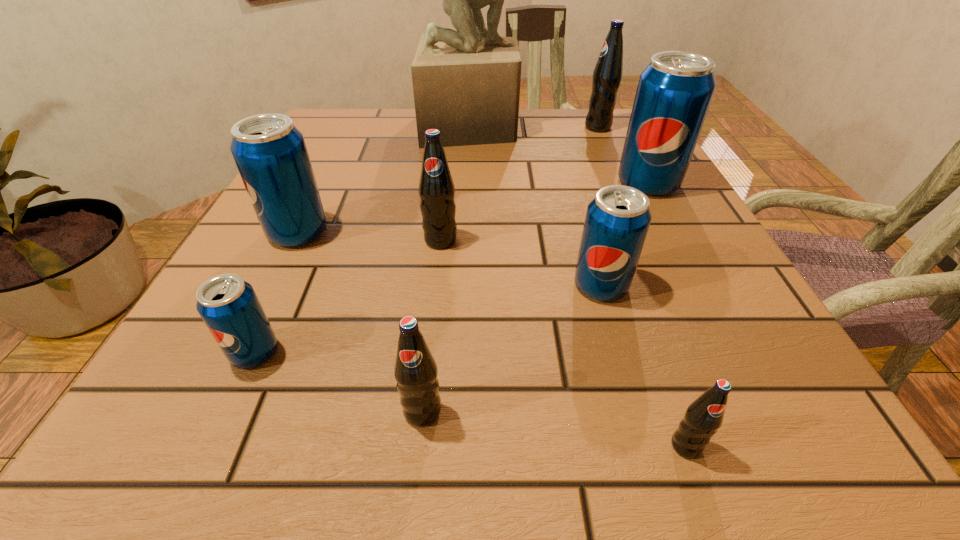
Locate an element on the screen. vacant space at the near edge of the desktop is located at coordinates (541, 396).

The width and height of the screenshot is (960, 540). In the image, there is a desktop. Identify the location of vacant space at the left edge. (344, 173).

The image size is (960, 540). Identify the location of blank space at the right edge. (658, 235).

Locate an element on the screen. The height and width of the screenshot is (540, 960). free space at the far right corner of the desktop is located at coordinates (595, 151).

The height and width of the screenshot is (540, 960). In the image, there is a desktop. Find the location of `free region at the near right corner`. free region at the near right corner is located at coordinates (791, 424).

Image resolution: width=960 pixels, height=540 pixels. What are the coordinates of `free spot between the sculpture and the nearest blue pop soda` in the screenshot? It's located at click(363, 239).

Locate an element on the screen. Image resolution: width=960 pixels, height=540 pixels. empty location between the seventh farthest object and the nearest object is located at coordinates (470, 399).

Identify the location of vacant space that is in between the gray sculpture and the seventh farthest object. The width and height of the screenshot is (960, 540). (363, 239).

In order to click on vacant space that's between the second black pop from right to left and the nearest blue pop soda in this screenshot , I will do `click(470, 399)`.

Image resolution: width=960 pixels, height=540 pixels. In order to click on empty space between the second farthest black pop and the nearest blue pop soda in this screenshot , I will do `click(348, 296)`.